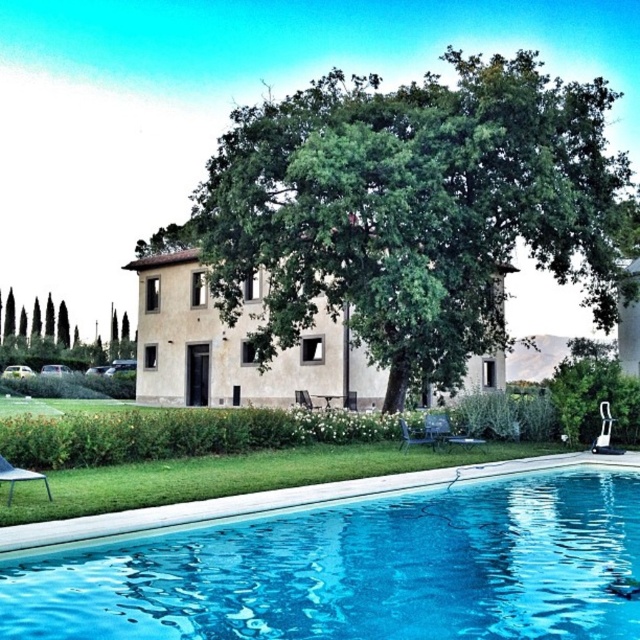
Question: Which point appears closest to the camera in this image?

Choices:
 (A) (496, 387)
 (B) (552, 115)

Answer: (B)

Question: Is blue glassy swimming pool at lower center positioned in front of beige stucco villa at center?

Choices:
 (A) yes
 (B) no

Answer: (A)

Question: Observing the image, what is the correct spatial positioning of blue glassy swimming pool at lower center in reference to beige stucco villa at center?

Choices:
 (A) below
 (B) above

Answer: (A)

Question: Considering the real-world distances, which object is closest to the green leafy tree at left?

Choices:
 (A) green leafy tree at center
 (B) beige stucco villa at center

Answer: (B)

Question: Which is nearer to the green leafy tree at center?

Choices:
 (A) green leafy tree at left
 (B) blue glassy swimming pool at lower center
 (C) beige stucco villa at center

Answer: (C)

Question: Where is green leafy tree at center located in relation to green leafy tree at left in the image?

Choices:
 (A) above
 (B) below

Answer: (A)